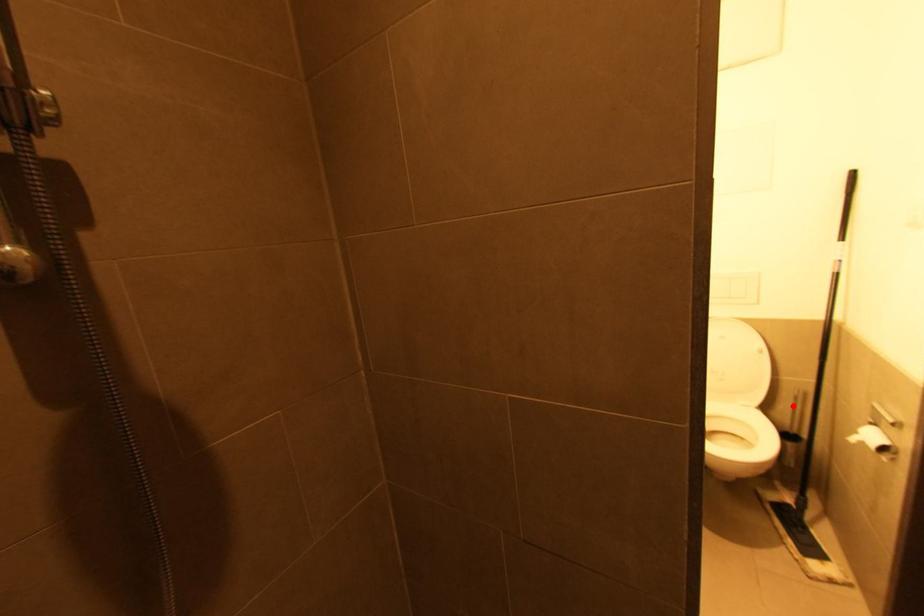
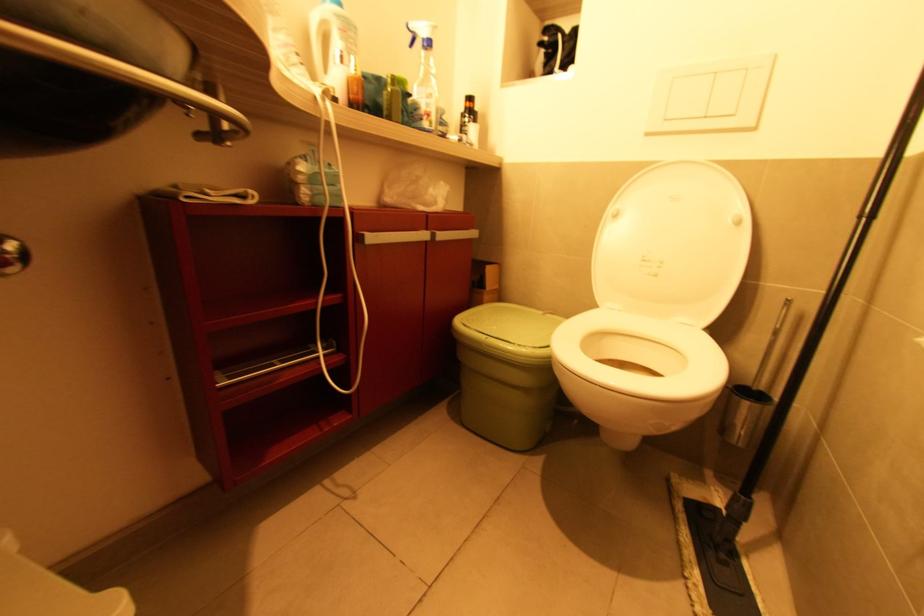
Question: I am providing you with two images of the same scene from different viewpoints. A red point is shown in image1. For the corresponding object point in image2, is it positioned nearer or farther from the camera?

Choices:
 (A) Nearer
 (B) Farther

Answer: (A)